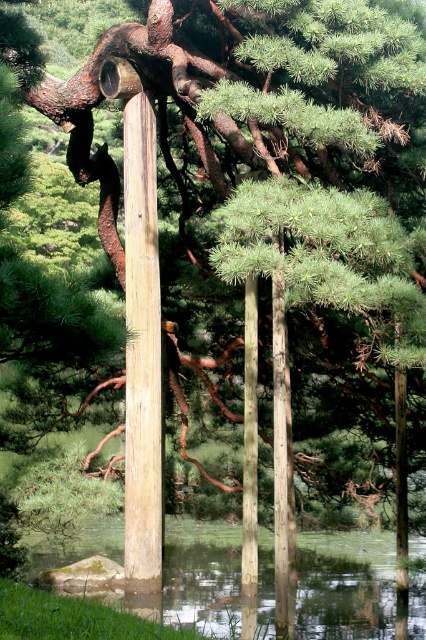
Question: Which point is farther to the camera?

Choices:
 (A) [244, 378]
 (B) [279, 380]
 (C) [365, 573]

Answer: (C)

Question: Which object is positioned closest to the smooth gray pole at center?

Choices:
 (A) smooth wood pole at center
 (B) light brown wood post at center

Answer: (A)

Question: Can you confirm if light brown wood post at center is smaller than smooth gray pole at center?

Choices:
 (A) yes
 (B) no

Answer: (B)

Question: Which object is closer to the camera taking this photo?

Choices:
 (A) smooth wood pole at center
 (B) smooth gray pole at center
 (C) light brown wood post at center

Answer: (A)

Question: Is light brown wood post at center thinner than smooth wood pole at center?

Choices:
 (A) no
 (B) yes

Answer: (A)

Question: Is smooth wood pole at center thinner than smooth gray pole at center?

Choices:
 (A) no
 (B) yes

Answer: (B)